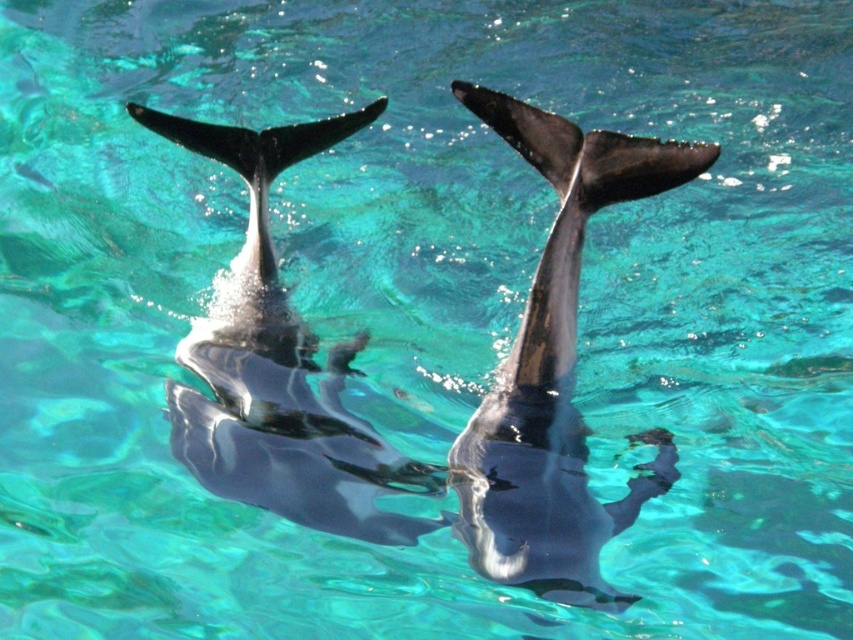
Question: Which object is farther from the camera taking this photo?

Choices:
 (A) shiny black dolphin at center
 (B) glossy black dolphin at center

Answer: (A)

Question: Is glossy black dolphin at center bigger than shiny black dolphin at center?

Choices:
 (A) no
 (B) yes

Answer: (A)

Question: Does glossy black dolphin at center have a smaller size compared to shiny black dolphin at center?

Choices:
 (A) no
 (B) yes

Answer: (B)

Question: Which object is farther from the camera taking this photo?

Choices:
 (A) shiny black dolphin at center
 (B) glossy black dolphin at center

Answer: (A)

Question: Considering the relative positions of glossy black dolphin at center and shiny black dolphin at center in the image provided, where is glossy black dolphin at center located with respect to shiny black dolphin at center?

Choices:
 (A) above
 (B) below

Answer: (A)